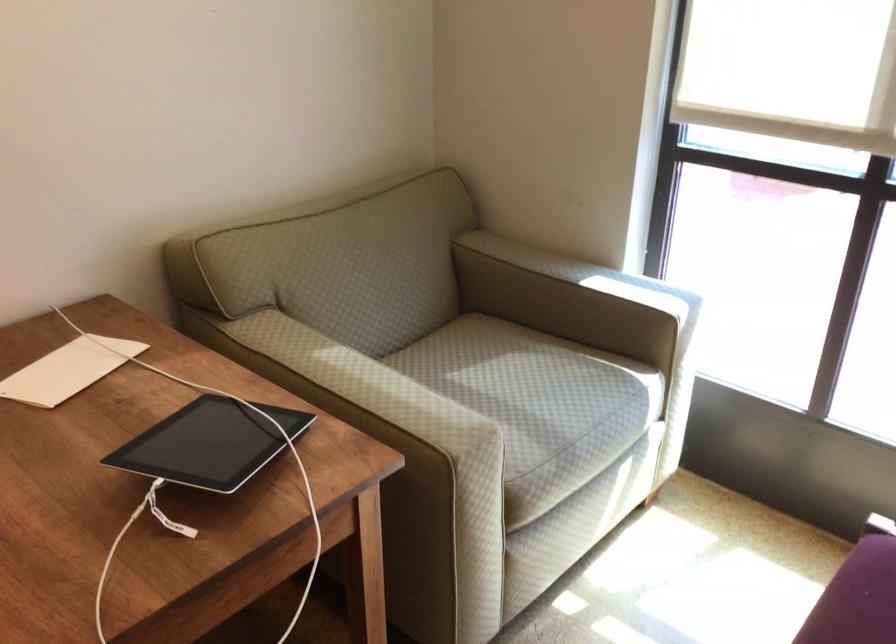
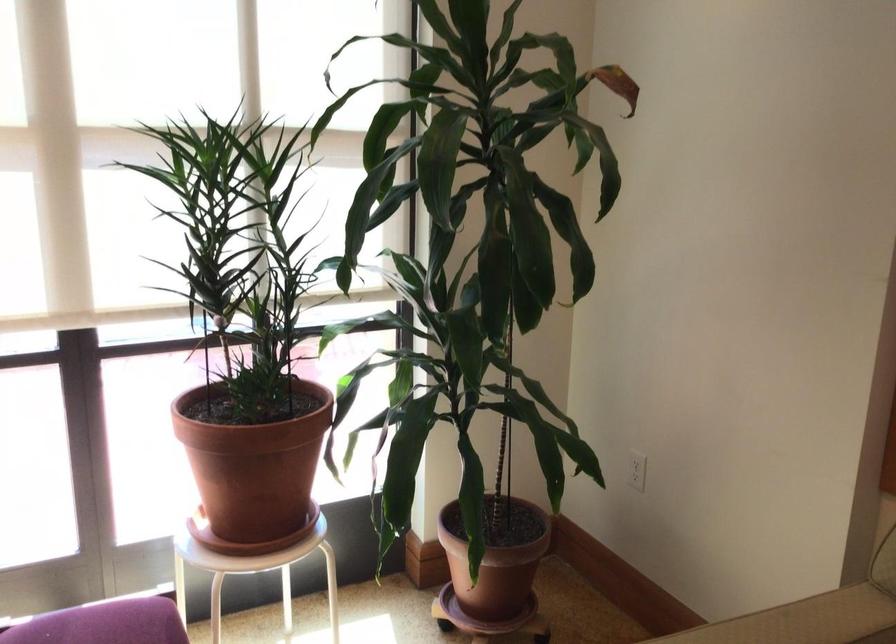
Question: Based on the continuous images, in which direction is the camera rotating? Reply with the corresponding letter.

Choices:
 (A) Left
 (B) Right
 (C) Up
 (D) Down

Answer: (B)